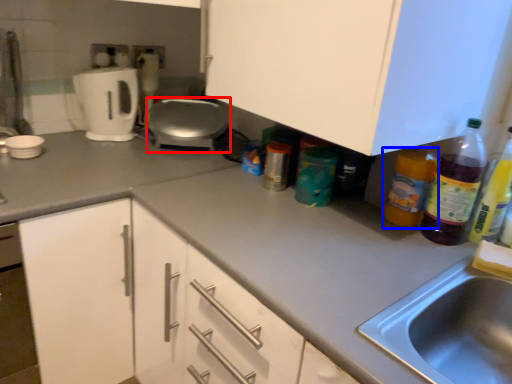
Question: Among these objects, which one is nearest to the camera, appliance (highlighted by a red box) or bottle (highlighted by a blue box)?

Choices:
 (A) appliance
 (B) bottle

Answer: (B)